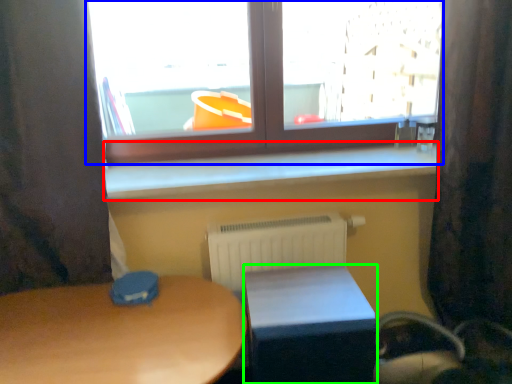
Question: Based on their relative distances, which object is nearer to window sill (highlighted by a red box)? Choose from window (highlighted by a blue box) and table (highlighted by a green box).

Choices:
 (A) window
 (B) table

Answer: (A)